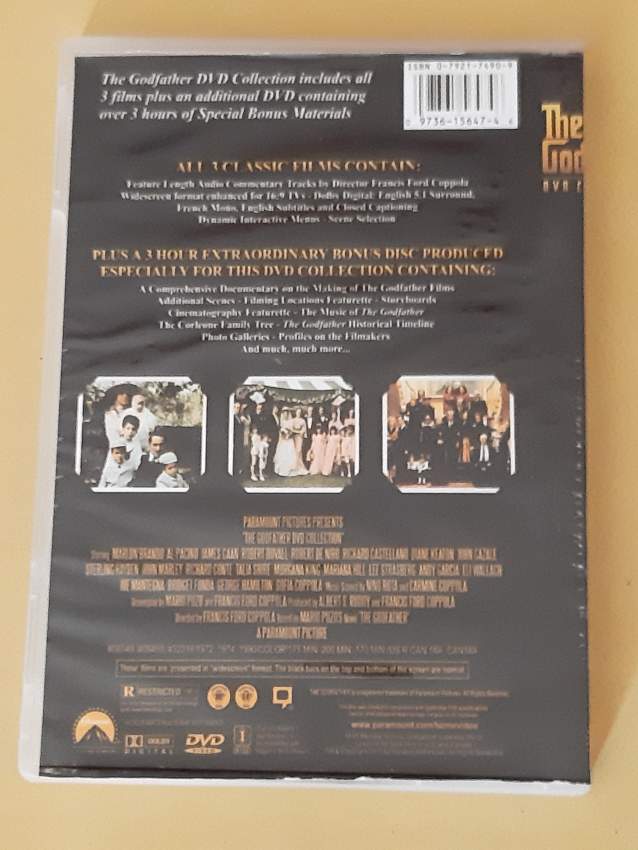
Find the location of `black plastic case`. black plastic case is located at coordinates (549, 655).